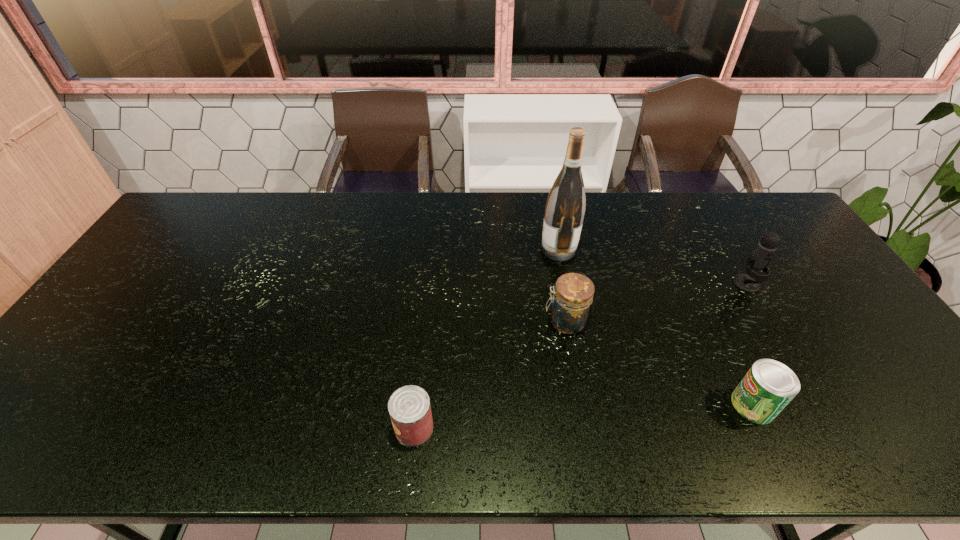
This screenshot has height=540, width=960. Identify the location of free point between the leftmost object and the wine bottle. (487, 339).

Where is `object that is the closest to the left can`? object that is the closest to the left can is located at coordinates (570, 308).

Locate which object ranks second in proximity to the right can. Please provide its 2D coordinates. Your answer should be formatted as a tuple, i.e. [(x, y)], where the tuple contains the x and y coordinates of a point satisfying the conditions above.

[(570, 308)]

At what (x,y) coordinates should I click in order to perform the action: click on free region that satisfies the following two spatial constraints: 1. on the back side of the fourth nearest object; 2. on the label of the tallest object. Please return your answer as a coordinate pair (x, y). The width and height of the screenshot is (960, 540). Looking at the image, I should click on (727, 249).

Find the location of `free spot that satisfies the following two spatial constraints: 1. on the lid of the third shortest object; 2. on the left side of the fourth object from left to right`. free spot that satisfies the following two spatial constraints: 1. on the lid of the third shortest object; 2. on the left side of the fourth object from left to right is located at coordinates (580, 405).

Locate an element on the screen. The image size is (960, 540). blank space that satisfies the following two spatial constraints: 1. on the label of the tallest object; 2. on the left side of the microphone is located at coordinates (565, 284).

You are a GUI agent. You are given a task and a screenshot of the screen. Output one action in this format:
    pyautogui.click(x=<x>, y=<y>)
    Task: Click on the vacant space that satisfies the following two spatial constraints: 1. on the label of the microphone; 2. on the right side of the farthest object
    
    Given the screenshot: What is the action you would take?
    pyautogui.click(x=565, y=284)

This screenshot has width=960, height=540. In order to click on vacant space that satisfies the following two spatial constraints: 1. on the label of the fourth shortest object; 2. on the right side of the tallest object in this screenshot , I will do (x=565, y=284).

Find the location of a particular element. This screenshot has height=540, width=960. free space that satisfies the following two spatial constraints: 1. on the back side of the right can; 2. on the lid of the third farthest object is located at coordinates (713, 322).

At what (x,y) coordinates should I click in order to perform the action: click on free space that satisfies the following two spatial constraints: 1. on the back side of the fourth object from left to right; 2. on the label of the farthest object. Please return your answer as a coordinate pair (x, y). Looking at the image, I should click on (679, 249).